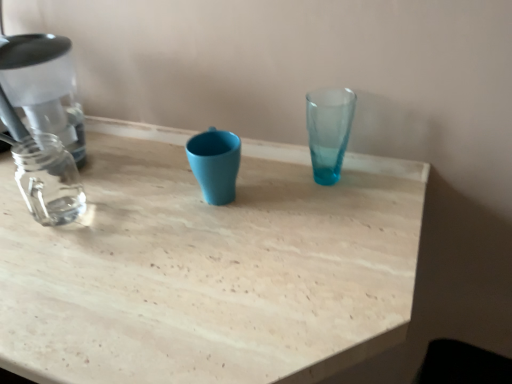
Where is `free space above light wood table at center (from a real-world perspective)`? The width and height of the screenshot is (512, 384). free space above light wood table at center (from a real-world perspective) is located at coordinates (166, 318).